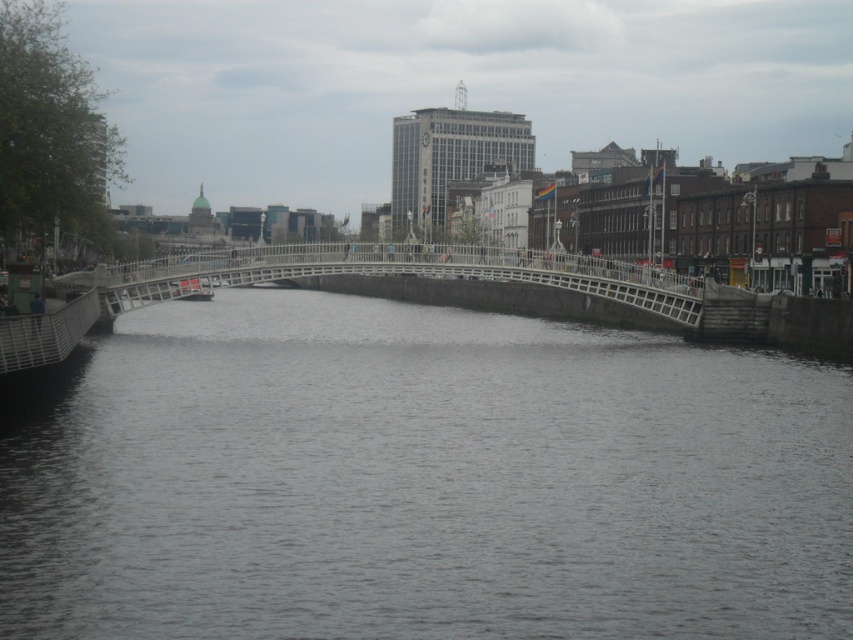
Question: Based on their relative distances, which object is farther from the white metal bridge at center?

Choices:
 (A) gray concrete water at center
 (B) metallic gray boat at center

Answer: (A)

Question: Estimate the real-world distances between objects in this image. Which object is farther from the metallic gray boat at center?

Choices:
 (A) white metal bridge at center
 (B) gray concrete water at center

Answer: (B)

Question: Is gray concrete water at center to the right of metallic gray boat at center from the viewer's perspective?

Choices:
 (A) no
 (B) yes

Answer: (B)

Question: Among these objects, which one is nearest to the camera?

Choices:
 (A) white metal bridge at center
 (B) gray concrete water at center
 (C) metallic gray boat at center

Answer: (B)

Question: In this image, where is gray concrete water at center located relative to metallic gray boat at center?

Choices:
 (A) below
 (B) above

Answer: (A)

Question: Can you confirm if white metal bridge at center is wider than metallic gray boat at center?

Choices:
 (A) yes
 (B) no

Answer: (A)